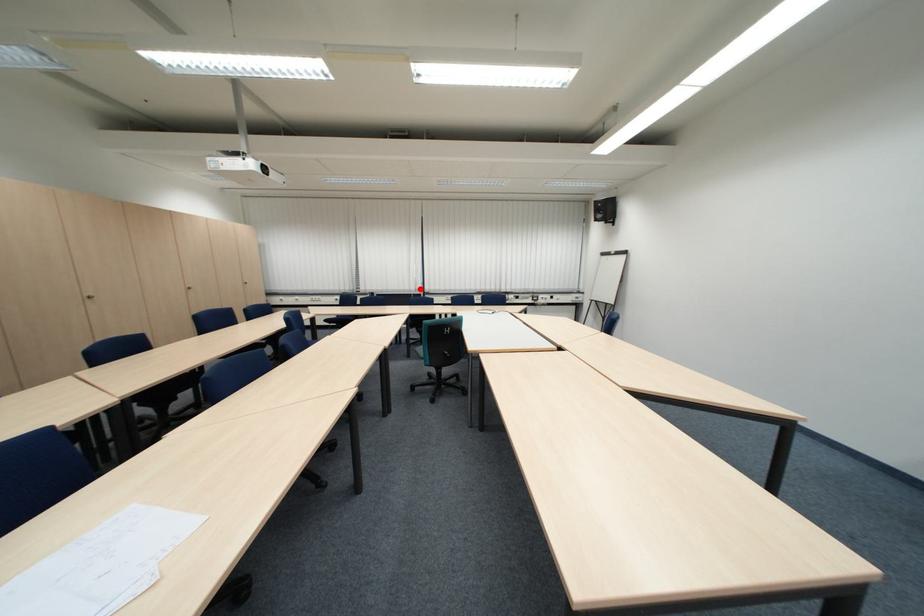
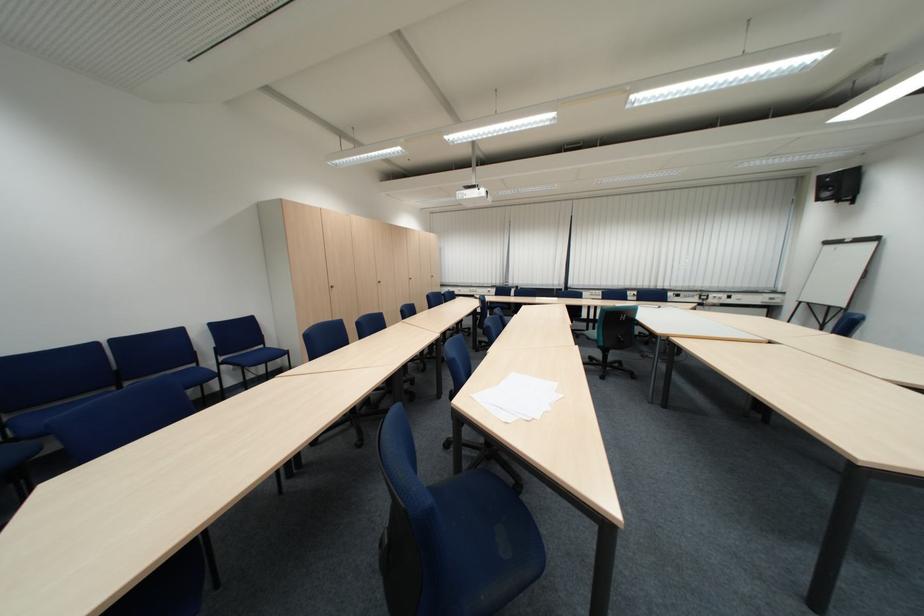
Where in the second image is the point corresponding to the highlighted location from the first image?

(564, 284)